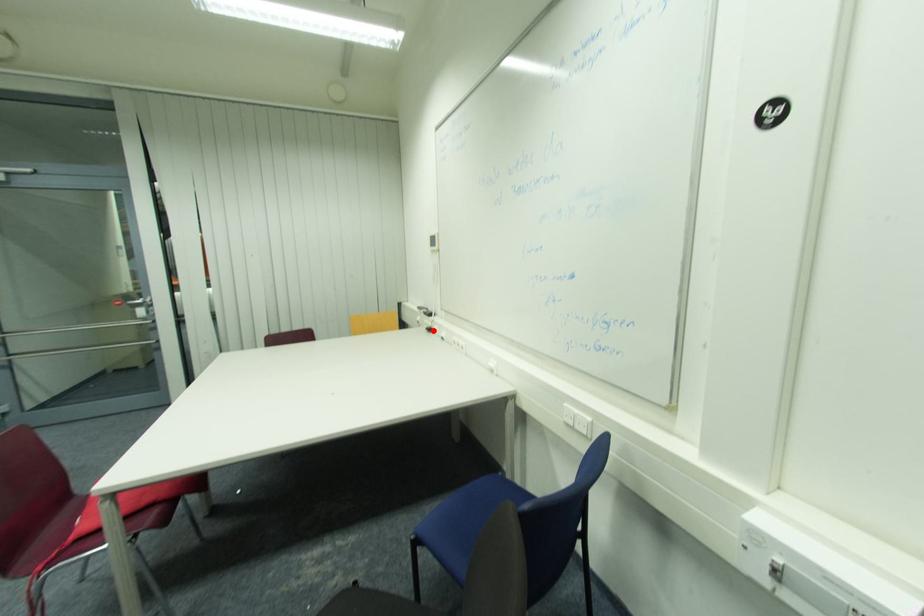
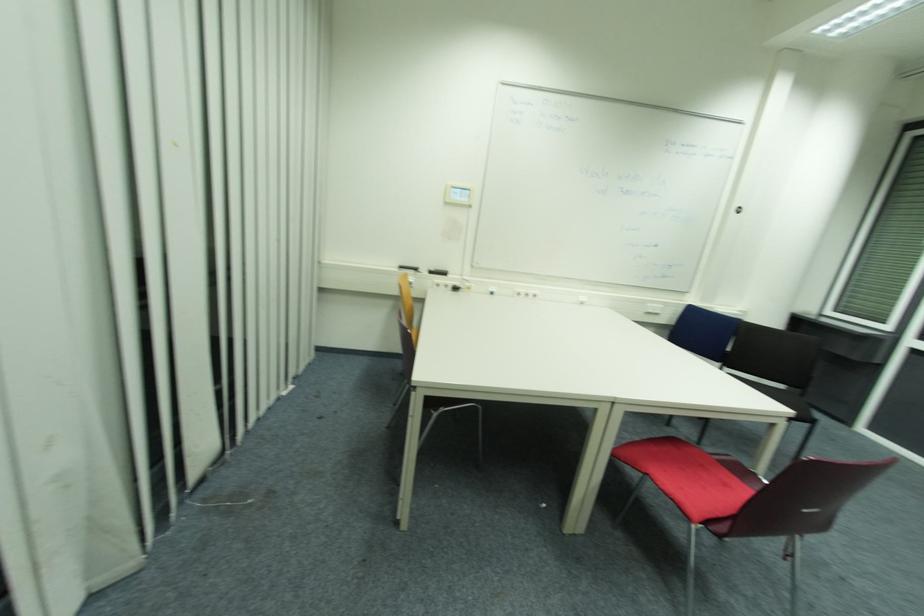
Question: I am providing you with two images of the same scene from different viewpoints. Given a red point in image1, look at the same physical point in image2. Is it:

Choices:
 (A) Closer to the viewpoint
 (B) Farther from the viewpoint

Answer: (A)